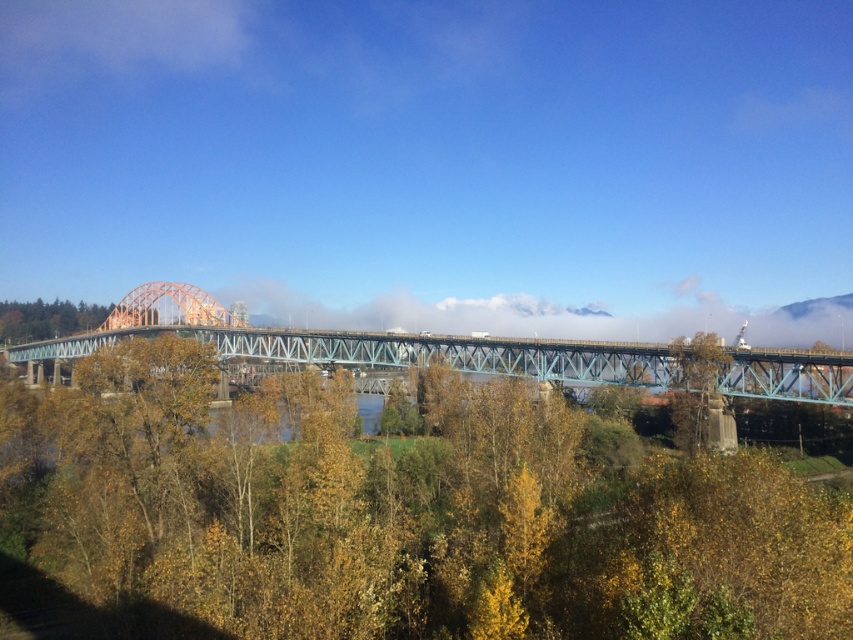
You are standing on the teal metallic bridge at center and want to take a photo of the yellow leafy tree at center. Which direction should you face to ensure the tree is fully visible in the frame?

The yellow leafy tree at center is taller than the teal metallic bridge at center, so you should face upward to ensure the tree is fully visible in the frame.

You are standing at the base of the yellow leafy tree at center and want to take a photo of it using a camera that has a maximum focus range of 100 feet. Will the camera be able to focus on the tree?

The yellow leafy tree at center and camera are 109.91 feet apart from each other. Since the camera can only focus up to 100 feet, it will not be able to focus on the tree.

You are standing on the bridge and see two points marked on the bridge deck. The first point is at coordinates point [656,554] and the second point is at point [305,342]. Which point is closer to you when you are facing the direction the bridge is going?

Point [656,554] is in front of point [305,342], so when facing the direction the bridge is going, the first point is closer to you.